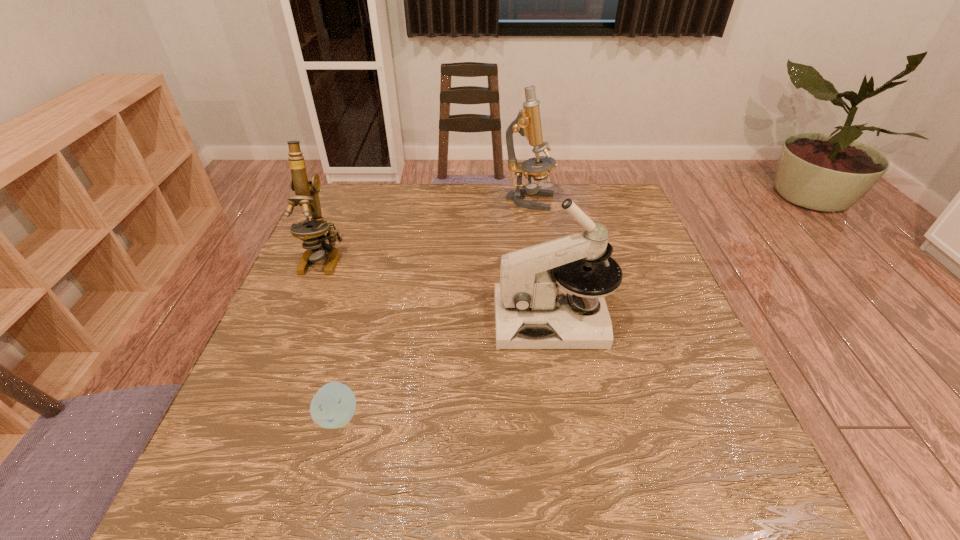
Locate an element on the screen. This screenshot has height=540, width=960. vacant space situated on the back of the third nearest object is located at coordinates (354, 183).

Identify the location of vacant area located on the left of the nearest object. This screenshot has height=540, width=960. 292,416.

Find the location of `object that is at the far edge`. object that is at the far edge is located at coordinates (528, 122).

Where is `object located in the left edge section of the desktop`? object located in the left edge section of the desktop is located at coordinates (312, 233).

What are the coordinates of `vacant space at the far edge of the desktop` in the screenshot? It's located at (460, 206).

The height and width of the screenshot is (540, 960). What are the coordinates of `vacant space at the near edge of the desktop` in the screenshot? It's located at (410, 488).

The image size is (960, 540). I want to click on vacant space at the left edge of the desktop, so click(x=329, y=340).

You are a GUI agent. You are given a task and a screenshot of the screen. Output one action in this format:
    pyautogui.click(x=<x>, y=<y>)
    Task: Click on the vacant position at the right edge of the desktop
    
    Given the screenshot: What is the action you would take?
    pyautogui.click(x=660, y=413)

Where is `blank space at the far left corner of the desktop`? This screenshot has width=960, height=540. blank space at the far left corner of the desktop is located at coordinates (351, 186).

Identify the location of free location at the near left corner of the desktop. Image resolution: width=960 pixels, height=540 pixels. (203, 468).